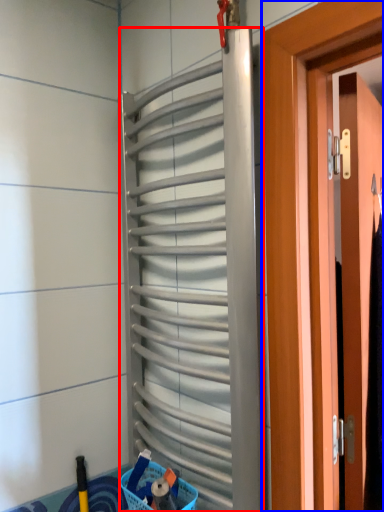
Question: Which object is closer to the camera taking this photo, shutter (highlighted by a red box) or door (highlighted by a blue box)?

Choices:
 (A) shutter
 (B) door

Answer: (A)